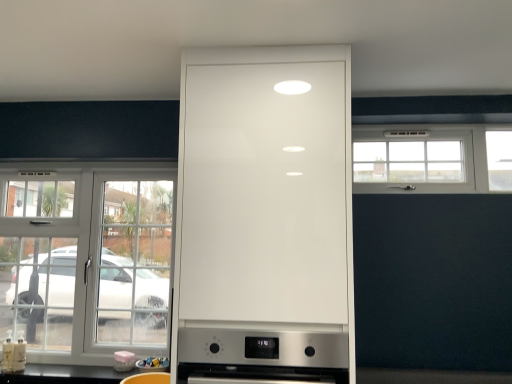
The image size is (512, 384). What do you see at coordinates (153, 364) in the screenshot?
I see `matte plastic container at lower center, marked as the first appliance in a right-to-left arrangement` at bounding box center [153, 364].

The width and height of the screenshot is (512, 384). What do you see at coordinates (433, 158) in the screenshot? I see `white plastic window at upper right, the 2th window when ordered from bottom to top` at bounding box center [433, 158].

The image size is (512, 384). Find the location of `white glossy cabinet at center`. white glossy cabinet at center is located at coordinates (264, 217).

Find the location of a particular element. This screenshot has width=512, height=384. stainless steel oven at center is located at coordinates (262, 355).

Can you confirm if white glossy cup at lower center, positioned as the first appliance in left-to-right order, is bigger than white plastic window at upper right, which is the 2th window from left to right?

No.

Is white glossy cup at lower center, positioned as the first appliance in left-to-right order, positioned beyond the bounds of white plastic window at upper right, the 2th window when ordered from bottom to top?

That's correct, white glossy cup at lower center, positioned as the first appliance in left-to-right order, is outside of white plastic window at upper right, the 2th window when ordered from bottom to top.

Which object is closer to the camera, white glossy cup at lower center, positioned as the first appliance in left-to-right order, or white plastic window at upper right, which is the 2th window from left to right?

white plastic window at upper right, which is the 2th window from left to right, is more forward.

Based on the photo, from the image's perspective, is white glossy cup at lower center, positioned as the first appliance in left-to-right order, on top of white plastic window at upper right, which is the 2th window from left to right?

No, from the image's perspective, white glossy cup at lower center, positioned as the first appliance in left-to-right order, is not above white plastic window at upper right, which is the 2th window from left to right.

Is stainless steel oven at center outside of matte plastic container at lower center, marked as the first appliance in a right-to-left arrangement?

stainless steel oven at center is positioned outside matte plastic container at lower center, marked as the first appliance in a right-to-left arrangement.

Which of these two, stainless steel oven at center or matte plastic container at lower center, arranged as the second appliance when viewed from the left, is thinner?

matte plastic container at lower center, arranged as the second appliance when viewed from the left.

Find the location of `home appliance on the right side of matte plastic container at lower center, marked as the first appliance in a right-to-left arrangement`. home appliance on the right side of matte plastic container at lower center, marked as the first appliance in a right-to-left arrangement is located at coordinates coord(262,355).

From the image's perspective, relative to matte plastic container at lower center, arranged as the second appliance when viewed from the left, is stainless steel oven at center above or below?

Clearly, from the image's perspective, stainless steel oven at center is above matte plastic container at lower center, arranged as the second appliance when viewed from the left.

Considering the sizes of white glossy cup at lower center, positioned as the first appliance in left-to-right order, and white glass window at left, acting as the 2th window starting from the right, in the image, is white glossy cup at lower center, positioned as the first appliance in left-to-right order, wider or thinner than white glass window at left, acting as the 2th window starting from the right,?

In the image, white glossy cup at lower center, positioned as the first appliance in left-to-right order, appears to be more narrow than white glass window at left, acting as the 2th window starting from the right.

Between white glossy cup at lower center, which is counted as the second appliance, starting from the right, and white glass window at left, the 1th window ordered from the bottom, which one has less height?

white glossy cup at lower center, which is counted as the second appliance, starting from the right, is shorter.

Identify the location of window that is on the left side of white glossy cup at lower center, positioned as the first appliance in left-to-right order. (86, 259).

Which is less distant, (126,355) or (140,192)?

The point (126,355) is closer.

Find the location of a particular element. The image size is (512, 384). window on the left of white glossy cabinet at center is located at coordinates (86, 259).

Is white glass window at left, which is the 2th window from top to bottom, facing away from white glossy cabinet at center?

white glass window at left, which is the 2th window from top to bottom, does not have its back to white glossy cabinet at center.

Is white glass window at left, the first window positioned from the left, located outside white glossy cabinet at center?

Yes.

From the image's perspective, which one is positioned higher, white glass window at left, the first window positioned from the left, or white glossy cabinet at center?

white glossy cabinet at center is shown above in the image.

Is white plastic window at upper right, which is the 2th window from left to right, placed right next to black glossy countertop at lower left?

white plastic window at upper right, which is the 2th window from left to right, and black glossy countertop at lower left are clearly separated.

Is white plastic window at upper right, the 2th window when ordered from bottom to top, in front of or behind black glossy countertop at lower left in the image?

white plastic window at upper right, the 2th window when ordered from bottom to top, is positioned farther from the viewer than black glossy countertop at lower left.

Which is more to the left, white plastic window at upper right, the 1th window viewed from the right, or black glossy countertop at lower left?

black glossy countertop at lower left.

Can you confirm if white plastic window at upper right, which is the 2th window from left to right, is bigger than black glossy countertop at lower left?

Indeed, white plastic window at upper right, which is the 2th window from left to right, has a larger size compared to black glossy countertop at lower left.

Does point (18, 235) appear closer or farther from the camera than point (149, 357)?

Clearly, point (18, 235) is more distant from the camera than point (149, 357).

How many degrees apart are the facing directions of white glass window at left, the first window positioned from the left, and matte plastic container at lower center, arranged as the second appliance when viewed from the left?

1.49 degrees separate the facing orientations of white glass window at left, the first window positioned from the left, and matte plastic container at lower center, arranged as the second appliance when viewed from the left.

Which object is thinner, white glass window at left, which is the 2th window from top to bottom, or matte plastic container at lower center, arranged as the second appliance when viewed from the left?

white glass window at left, which is the 2th window from top to bottom, is thinner.

Is white glass window at left, which is the 2th window from top to bottom, turned away from matte plastic container at lower center, marked as the first appliance in a right-to-left arrangement?

No, white glass window at left, which is the 2th window from top to bottom, is not facing away from matte plastic container at lower center, marked as the first appliance in a right-to-left arrangement.

From a real-world perspective, which object rests below the other?

From a 3D spatial view, matte plastic container at lower center, arranged as the second appliance when viewed from the left, is below.

Is matte plastic container at lower center, marked as the first appliance in a right-to-left arrangement, at the back of white plastic window at upper right, which is the 2th window from left to right?

No, white plastic window at upper right, which is the 2th window from left to right,'s orientation is not away from matte plastic container at lower center, marked as the first appliance in a right-to-left arrangement.

Does white plastic window at upper right, the 1th window viewed from the right, have a lesser width compared to matte plastic container at lower center, marked as the first appliance in a right-to-left arrangement?

Yes, white plastic window at upper right, the 1th window viewed from the right, is thinner than matte plastic container at lower center, marked as the first appliance in a right-to-left arrangement.

Does white plastic window at upper right, which is the 1th window in top-to-bottom order, have a smaller size compared to matte plastic container at lower center, marked as the first appliance in a right-to-left arrangement?

Actually, white plastic window at upper right, which is the 1th window in top-to-bottom order, might be larger than matte plastic container at lower center, marked as the first appliance in a right-to-left arrangement.

The image size is (512, 384). I want to click on window in front of the white glossy cup at lower center, positioned as the first appliance in left-to-right order, so click(x=433, y=158).

The width and height of the screenshot is (512, 384). Identify the location of home appliance above the matte plastic container at lower center, arranged as the second appliance when viewed from the left (from a real-world perspective). (262, 355).

Looking at the image, which one is located closer to white plastic window at upper right, which is the 1th window in top-to-bottom order, stainless steel oven at center or matte plastic container at lower center, arranged as the second appliance when viewed from the left?

stainless steel oven at center lies closer to white plastic window at upper right, which is the 1th window in top-to-bottom order, than the other object.

From the image, which object appears to be nearer to stainless steel oven at center, white glossy cabinet at center or white glossy cup at lower center, which is counted as the second appliance, starting from the right?

white glossy cabinet at center is closer to stainless steel oven at center.

Considering their positions, is matte plastic container at lower center, marked as the first appliance in a right-to-left arrangement, positioned further to white plastic window at upper right, the 1th window viewed from the right, than stainless steel oven at center?

The object further to white plastic window at upper right, the 1th window viewed from the right, is matte plastic container at lower center, marked as the first appliance in a right-to-left arrangement.

Looking at the image, which one is located closer to white glossy cabinet at center, black glossy countertop at lower left or white glossy cup at lower center, which is counted as the second appliance, starting from the right?

Among the two, black glossy countertop at lower left is located nearer to white glossy cabinet at center.

From the image, which object appears to be farther from stainless steel oven at center, black glossy countertop at lower left or white plastic window at upper right, which is the 2th window from left to right?

white plastic window at upper right, which is the 2th window from left to right, is further to stainless steel oven at center.

Looking at the image, which one is located closer to stainless steel oven at center, black glossy countertop at lower left or white glass window at left, which is the 2th window from top to bottom?

Based on the image, black glossy countertop at lower left appears to be nearer to stainless steel oven at center.

From the image, which object appears to be nearer to white glass window at left, the 1th window ordered from the bottom, white plastic window at upper right, which is the 2th window from left to right, or white glossy cup at lower center, which is counted as the second appliance, starting from the right?

white glossy cup at lower center, which is counted as the second appliance, starting from the right, is closer to white glass window at left, the 1th window ordered from the bottom.

Considering their positions, is black glossy countertop at lower left positioned closer to matte plastic container at lower center, marked as the first appliance in a right-to-left arrangement, than white glossy cup at lower center, which is counted as the second appliance, starting from the right?

white glossy cup at lower center, which is counted as the second appliance, starting from the right.

Where is `home appliance located between black glossy countertop at lower left and white plastic window at upper right, the 1th window viewed from the right, in the left-right direction`? home appliance located between black glossy countertop at lower left and white plastic window at upper right, the 1th window viewed from the right, in the left-right direction is located at coordinates (262, 355).

Image resolution: width=512 pixels, height=384 pixels. Find the location of `cabinetry located between matte plastic container at lower center, arranged as the second appliance when viewed from the left, and white plastic window at upper right, which is the 1th window in top-to-bottom order, in the left-right direction`. cabinetry located between matte plastic container at lower center, arranged as the second appliance when viewed from the left, and white plastic window at upper right, which is the 1th window in top-to-bottom order, in the left-right direction is located at coordinates (264, 217).

The width and height of the screenshot is (512, 384). I want to click on appliance between white glass window at left, acting as the 2th window starting from the right, and white glossy cup at lower center, which is counted as the second appliance, starting from the right, vertically, so click(x=153, y=364).

Find the location of a particular element. counter top between white glass window at left, which is the 2th window from top to bottom, and white glossy cabinet at center from left to right is located at coordinates (66, 375).